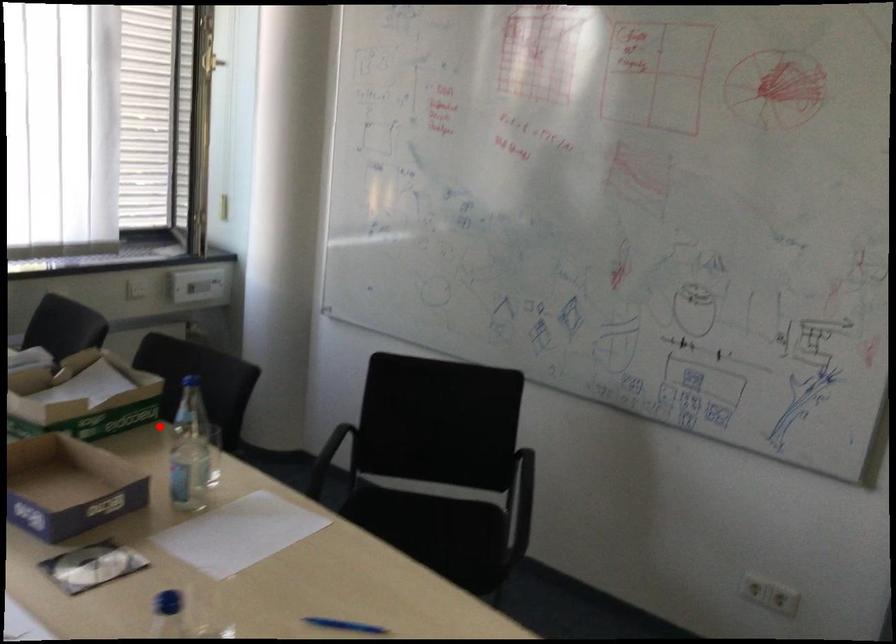
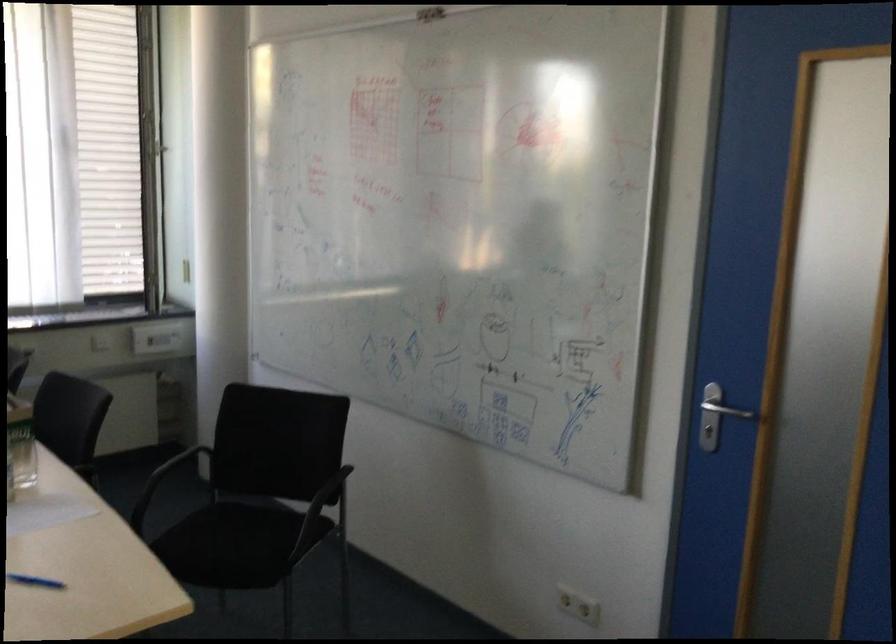
Question: I am providing you with two images of the same scene from different viewpoints. Image1 has a red point marked. In image2, the corresponding 3D location appears at what relative position? Reply with the corresponding letter.

Choices:
 (A) Closer
 (B) Farther

Answer: (B)